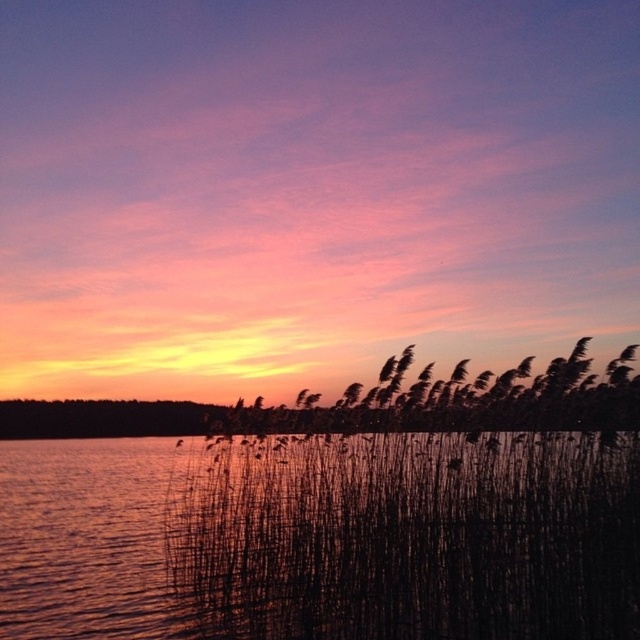
Is silky reeds at center to the left of black reed at center from the viewer's perspective?

Incorrect, silky reeds at center is not on the left side of black reed at center.

Who is more distant from viewer, (300, 362) or (248, 534)?

Point (300, 362)

Image resolution: width=640 pixels, height=640 pixels. Find the location of `silky reeds at center`. silky reeds at center is located at coordinates (310, 192).